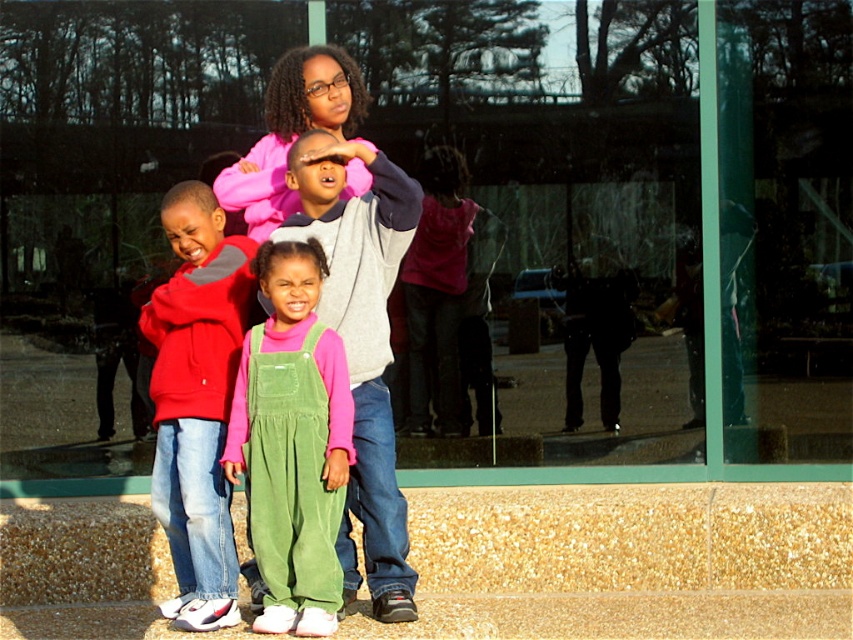
Question: Is green corduroy overalls at center smaller than red hoodie at left?

Choices:
 (A) no
 (B) yes

Answer: (B)

Question: Does red hoodie at left have a lesser width compared to pink fleece sweatshirt at center?

Choices:
 (A) yes
 (B) no

Answer: (A)

Question: Which point appears closest to the camera in this image?

Choices:
 (A) (395, 216)
 (B) (265, 556)

Answer: (B)

Question: Which of the following is the closest to the observer?

Choices:
 (A) (306, 236)
 (B) (289, 449)
 (C) (196, 483)

Answer: (B)

Question: Observing the image, what is the correct spatial positioning of green corduroy overalls at center in reference to pink fleece sweatshirt at center?

Choices:
 (A) right
 (B) left

Answer: (B)

Question: Which is nearer to the pink fleece sweatshirt at center?

Choices:
 (A) green corduroy overalls at center
 (B) red hoodie at left

Answer: (A)